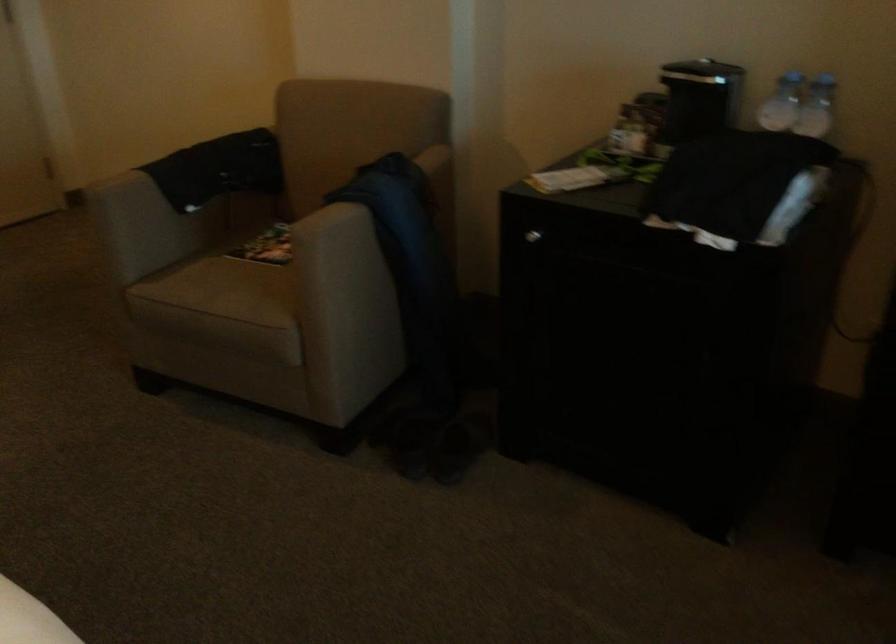
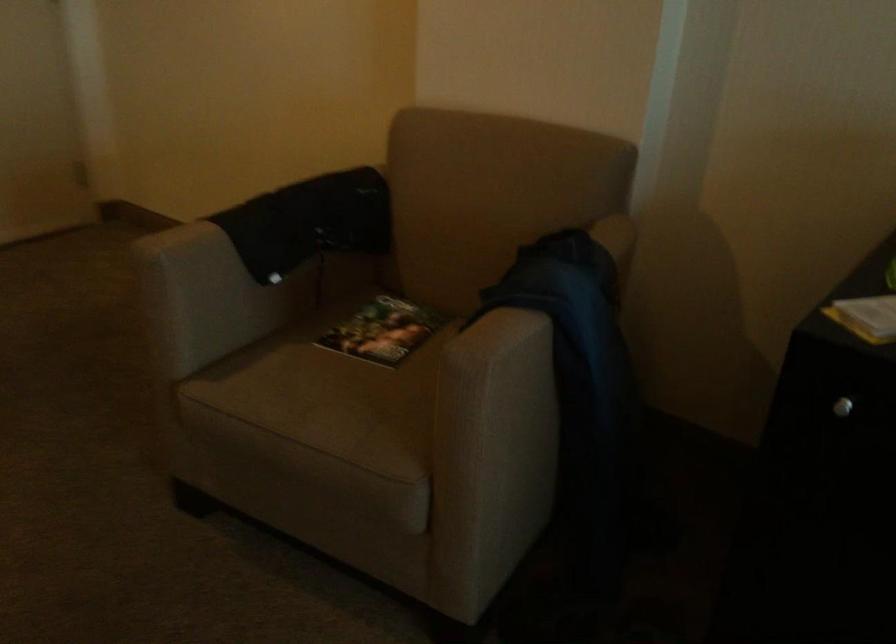
Locate, in the second image, the point that corresponds to (x=128, y=184) in the first image.

(201, 243)